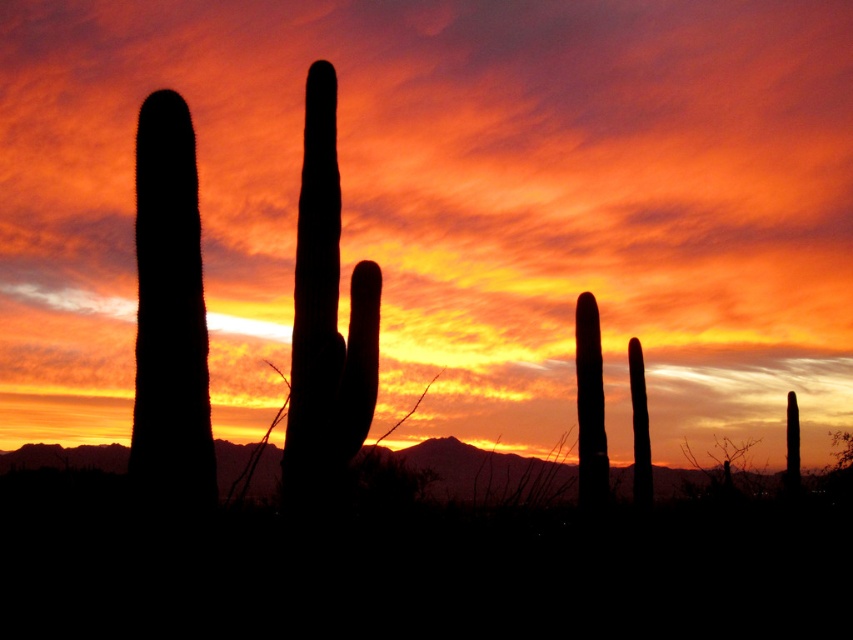
You are a photographer planning to capture the sunset with both the silhouette cactus at center and the silhouette cactus at right in your frame. Based on their heights, which cactus will appear larger in the photograph?

The silhouette cactus at center will appear larger in the photograph because it is much taller than the silhouette cactus at right.

You are standing in the desert at sunset and see a black matte cactus at left. There is a point marked at coordinates point (169, 316). Is this point located on the black matte cactus at left?

Yes, the point (169, 316) is located on the black matte cactus at left.

You are standing in the desert scene described. You need to locate the black matte cactus at left. According to the coordinates provided, where should you look relative to the center of the image?

The black matte cactus at left is located at coordinates approximately 0.495 on the x axis and 0.199 on the y axis, which places it slightly to the left and lower center of the image.